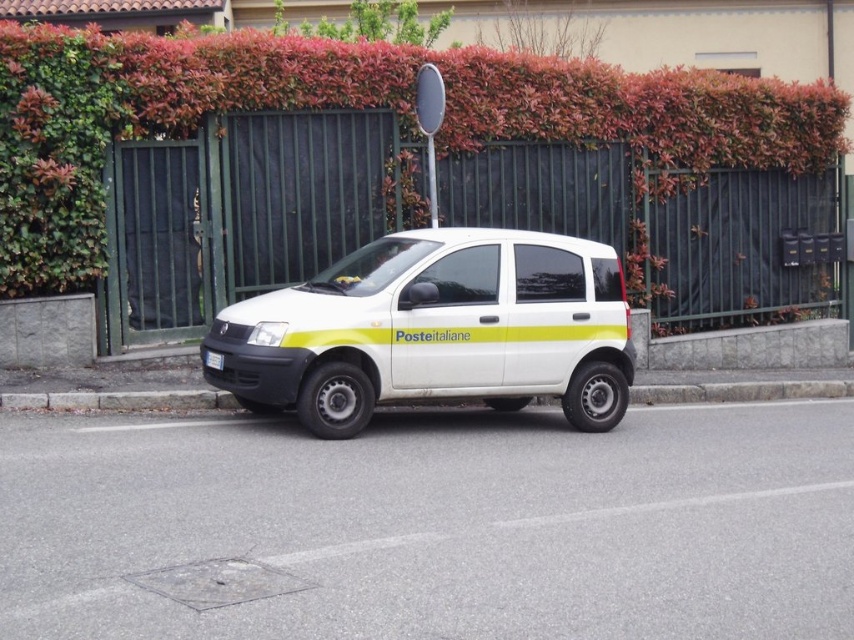
Question: Can you confirm if gray concrete curb at lower center is smaller than white plastic license plate at center?

Choices:
 (A) no
 (B) yes

Answer: (A)

Question: Estimate the real-world distances between objects in this image. Which object is closer to the white plastic license plate at center?

Choices:
 (A) green leafy hedge at upper center
 (B) white matte van at center
 (C) gray concrete curb at lower center

Answer: (C)

Question: Which point is farther to the camera?

Choices:
 (A) (39, 404)
 (B) (733, 125)
 (C) (205, 353)
 (D) (434, 280)

Answer: (B)

Question: Which object appears farthest from the camera in this image?

Choices:
 (A) gray concrete curb at lower center
 (B) white plastic license plate at center
 (C) green leafy hedge at upper center

Answer: (C)

Question: Can you confirm if green leafy hedge at upper center is positioned to the right of white matte van at center?

Choices:
 (A) yes
 (B) no

Answer: (A)

Question: Can you confirm if white matte van at center is positioned below gray concrete curb at lower center?

Choices:
 (A) no
 (B) yes

Answer: (A)